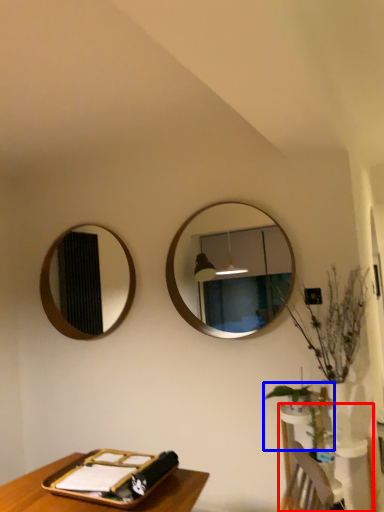
Question: Which of the following is the farthest to the observer, vanity (highlighted by a red box) or plant (highlighted by a blue box)?

Choices:
 (A) vanity
 (B) plant

Answer: (B)